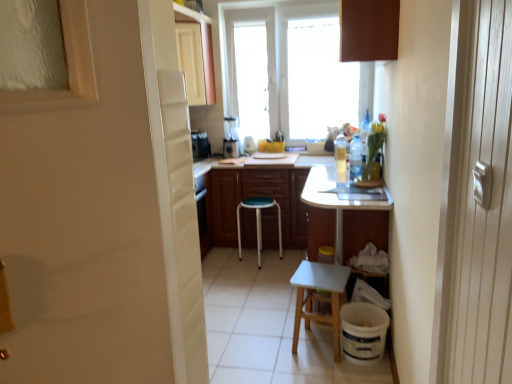
Describe the element at coordinates (259, 222) in the screenshot. This screenshot has height=384, width=512. I see `green plastic stool at center, placed as the first stool when sorted from back to front` at that location.

Describe the element at coordinates (319, 297) in the screenshot. I see `white wood stool at lower center, the 2th stool when ordered from back to front` at that location.

Identify the location of matte white cabinet at upper center, the third cabinetry from the right. (195, 55).

Identify the location of transparent plastic bottle at upper right, which ranks as the 3th bottle in front-to-back order. This screenshot has width=512, height=384. [x=364, y=135].

Identify the location of metallic silver blender at center. (231, 139).

Measure the distance between point (395, 24) and camera.

7.42 feet.

The image size is (512, 384). What do you see at coordinates (369, 30) in the screenshot?
I see `brown matte cabinet at upper center, placed as the 1th cabinetry when sorted from front to back` at bounding box center [369, 30].

Find the location of a particular element. This screenshot has width=512, height=384. green plastic stool at center, the 2th stool in the right-to-left sequence is located at coordinates (259, 222).

Is clear plastic bottle at right, arranged as the 1th bottle when viewed from the front, far away from white glossy screen door at left?

clear plastic bottle at right, arranged as the 1th bottle when viewed from the front, is positioned a significant distance from white glossy screen door at left.

From the image's perspective, is clear plastic bottle at right, the second bottle positioned from the left, beneath white glossy screen door at left?

No.

Is clear plastic bottle at right, the 3th bottle viewed from the back, positioned behind white glossy screen door at left?

Yes, clear plastic bottle at right, the 3th bottle viewed from the back, is further from the camera.

Find the location of `screen door that is in front of the clear plastic bottle at right, arranged as the 1th bottle when viewed from the front`. screen door that is in front of the clear plastic bottle at right, arranged as the 1th bottle when viewed from the front is located at coordinates (174, 190).

From the image's perspective, is white wood stool at lower center, placed as the 1th stool when sorted from front to back, located beneath matte white cabinet at upper center, placed as the first cabinetry when sorted from left to right?

Yes, from the image's perspective, white wood stool at lower center, placed as the 1th stool when sorted from front to back, is beneath matte white cabinet at upper center, placed as the first cabinetry when sorted from left to right.

Is point (297, 302) positioned before point (191, 81)?

Yes.

Could you tell me if white wood stool at lower center, which is counted as the 1th stool, starting from the right, is facing matte white cabinet at upper center, placed as the first cabinetry when sorted from left to right?

No, white wood stool at lower center, which is counted as the 1th stool, starting from the right, is not aimed at matte white cabinet at upper center, placed as the first cabinetry when sorted from left to right.

Is white wood stool at lower center, which is counted as the 1th stool, starting from the right, far away from matte white cabinet at upper center, acting as the first cabinetry starting from the top?

Absolutely, white wood stool at lower center, which is counted as the 1th stool, starting from the right, is distant from matte white cabinet at upper center, acting as the first cabinetry starting from the top.

Considering the sizes of objects matte white cabinet at upper center, positioned as the second cabinetry in front-to-back order, and white wood stool at lower center, which is counted as the 1th stool, starting from the right, in the image provided, who is taller, matte white cabinet at upper center, positioned as the second cabinetry in front-to-back order, or white wood stool at lower center, which is counted as the 1th stool, starting from the right,?

matte white cabinet at upper center, positioned as the second cabinetry in front-to-back order.

Is matte white cabinet at upper center, acting as the 2th cabinetry starting from the back, wider or thinner than white wood stool at lower center, marked as the 2th stool in a left-to-right arrangement?

Considering their sizes, matte white cabinet at upper center, acting as the 2th cabinetry starting from the back, looks broader than white wood stool at lower center, marked as the 2th stool in a left-to-right arrangement.

From the image's perspective, which one is positioned lower, matte white cabinet at upper center, the third cabinetry from the right, or white wood stool at lower center, the 2th stool when ordered from back to front?

white wood stool at lower center, the 2th stool when ordered from back to front.

From a real-world perspective, between matte white cabinet at upper center, arranged as the third cabinetry when ordered from the bottom, and white wood stool at lower center, the 2th stool when ordered from back to front, who is vertically higher?

matte white cabinet at upper center, arranged as the third cabinetry when ordered from the bottom, from a real-world perspective.

Does matte white cabinet at upper center, placed as the first cabinetry when sorted from left to right, have a lesser width compared to green plastic stool at center, placed as the first stool when sorted from back to front?

Yes.

Is matte white cabinet at upper center, positioned as the second cabinetry in front-to-back order, oriented towards green plastic stool at center, placed as the first stool when sorted from left to right?

No, matte white cabinet at upper center, positioned as the second cabinetry in front-to-back order, is not oriented towards green plastic stool at center, placed as the first stool when sorted from left to right.

What are the coordinates of `stool on the left side of brown matte cabinet at center, which appears as the 2th cabinetry when viewed from the right` in the screenshot? It's located at (259, 222).

Considering the sizes of brown matte cabinet at center, marked as the 3th cabinetry in a top-to-bottom arrangement, and green plastic stool at center, the 2th stool from the front, in the image, is brown matte cabinet at center, marked as the 3th cabinetry in a top-to-bottom arrangement, wider or thinner than green plastic stool at center, the 2th stool from the front,?

A: Clearly, brown matte cabinet at center, marked as the 3th cabinetry in a top-to-bottom arrangement, has more width compared to green plastic stool at center, the 2th stool from the front.

Does point (252, 212) appear closer or farther from the camera than point (258, 264)?

Point (252, 212) appears to be farther away from the viewer than point (258, 264).

Could you measure the distance between brown matte cabinet at upper center, marked as the 2th cabinetry in a top-to-bottom arrangement, and white glossy screen door at left?

brown matte cabinet at upper center, marked as the 2th cabinetry in a top-to-bottom arrangement, is 1.46 meters from white glossy screen door at left.

Is the surface of brown matte cabinet at upper center, marked as the 3th cabinetry in a left-to-right arrangement, in direct contact with white glossy screen door at left?

No, brown matte cabinet at upper center, marked as the 3th cabinetry in a left-to-right arrangement, is not making contact with white glossy screen door at left.

Considering the relative positions of brown matte cabinet at upper center, the 1th cabinetry in the right-to-left sequence, and white glossy screen door at left in the image provided, is brown matte cabinet at upper center, the 1th cabinetry in the right-to-left sequence, to the left of white glossy screen door at left from the viewer's perspective?

No.

Can white glossy screen door at left be found inside brown matte cabinet at upper center, placed as the 3th cabinetry when sorted from back to front?

Definitely not — white glossy screen door at left is not inside brown matte cabinet at upper center, placed as the 3th cabinetry when sorted from back to front.

Consider the image. Considering the relative sizes of transparent plastic bottle at upper right, which ranks as the 3th bottle in front-to-back order, and brown matte cabinet at upper center, marked as the 3th cabinetry in a left-to-right arrangement, in the image provided, is transparent plastic bottle at upper right, which ranks as the 3th bottle in front-to-back order, shorter than brown matte cabinet at upper center, marked as the 3th cabinetry in a left-to-right arrangement,?

No.

In the image, is transparent plastic bottle at upper right, which is counted as the 1th bottle, starting from the right, on the left side or the right side of brown matte cabinet at upper center, placed as the 1th cabinetry when sorted from front to back?

In the image, transparent plastic bottle at upper right, which is counted as the 1th bottle, starting from the right, appears on the right side of brown matte cabinet at upper center, placed as the 1th cabinetry when sorted from front to back.

Starting from the brown matte cabinet at upper center, marked as the 2th cabinetry in a top-to-bottom arrangement, which bottle is the 3rd one behind? Please provide its 2D coordinates.

[(364, 135)]

Can you tell me how much transparent plastic bottle at upper right, which ranks as the 3th bottle in front-to-back order, and brown matte cabinet at upper center, positioned as the 2th cabinetry in bottom-to-top order, differ in facing direction?

transparent plastic bottle at upper right, which ranks as the 3th bottle in front-to-back order, and brown matte cabinet at upper center, positioned as the 2th cabinetry in bottom-to-top order, are facing 90 degrees away from each other.

Where is `the 1st bottle above the white glossy screen door at left (from the image's perspective)`? The height and width of the screenshot is (384, 512). the 1st bottle above the white glossy screen door at left (from the image's perspective) is located at coordinates (355, 158).

Identify the location of the 2nd stool below the matte white cabinet at upper center, positioned as the second cabinetry in front-to-back order (from the image's perspective). This screenshot has width=512, height=384. (319, 297).

From the image, which object appears to be nearer to metallic silver blender at center, matte white cabinet at upper center, acting as the first cabinetry starting from the top, or green plastic stool at center, the 2th stool from the front?

Among the two, matte white cabinet at upper center, acting as the first cabinetry starting from the top, is located nearer to metallic silver blender at center.

Which object lies further to the anchor point green plastic stool at center, placed as the first stool when sorted from left to right, white wood stool at lower center, placed as the 1th stool when sorted from front to back, or clear plastic bottle at right, the second bottle positioned from the left?

The object further to green plastic stool at center, placed as the first stool when sorted from left to right, is white wood stool at lower center, placed as the 1th stool when sorted from front to back.

Based on their spatial positions, is brown matte cabinet at center, the first cabinetry in the back-to-front sequence, or metallic silver blender at center further from translucent plastic bottle at upper right, the 2th bottle when ordered from front to back?

metallic silver blender at center lies further to translucent plastic bottle at upper right, the 2th bottle when ordered from front to back, than the other object.

Estimate the real-world distances between objects in this image. Which object is closer to brown matte cabinet at upper center, marked as the 3th cabinetry in a left-to-right arrangement, clear plastic bottle at right, the 3th bottle viewed from the back, or translucent plastic bottle at upper right, the 2th bottle when ordered from front to back?

clear plastic bottle at right, the 3th bottle viewed from the back, is closer to brown matte cabinet at upper center, marked as the 3th cabinetry in a left-to-right arrangement.

Looking at this image, which object lies further to the anchor point clear plastic bottle at right, the 3th bottle viewed from the back, green plastic stool at center, the 2th stool from the front, or white glossy screen door at left?

Based on the image, white glossy screen door at left appears to be further to clear plastic bottle at right, the 3th bottle viewed from the back.

When comparing their distances from clear plastic bottle at right, the second bottle positioned from the left, does brown matte cabinet at center, the first cabinetry in the back-to-front sequence, or brown matte cabinet at upper center, the 1th cabinetry in the right-to-left sequence, seem further?

brown matte cabinet at center, the first cabinetry in the back-to-front sequence, is further to clear plastic bottle at right, the second bottle positioned from the left.

Based on their spatial positions, is brown matte cabinet at upper center, marked as the 2th cabinetry in a top-to-bottom arrangement, or brown matte cabinet at center, which appears as the 1th cabinetry when ordered from the bottom, further from white glossy screen door at left?

brown matte cabinet at center, which appears as the 1th cabinetry when ordered from the bottom, lies further to white glossy screen door at left than the other object.

When comparing their distances from translucent plastic bottle at upper right, the 2th bottle when ordered from front to back, does clear plastic bottle at right, the 3th bottle viewed from the back, or white glossy screen door at left seem closer?

clear plastic bottle at right, the 3th bottle viewed from the back, is positioned closer to the anchor translucent plastic bottle at upper right, the 2th bottle when ordered from front to back.

Where is `bottle between translucent plastic bottle at upper right, the 2th bottle when ordered from front to back, and white wood stool at lower center, the 2th stool when ordered from back to front, in the up-down direction`? The width and height of the screenshot is (512, 384). bottle between translucent plastic bottle at upper right, the 2th bottle when ordered from front to back, and white wood stool at lower center, the 2th stool when ordered from back to front, in the up-down direction is located at coordinates (355, 158).

Find the location of a particular element. The height and width of the screenshot is (384, 512). cabinetry between white glossy screen door at left and matte white cabinet at upper center, positioned as the second cabinetry in front-to-back order, in the front-back direction is located at coordinates (369, 30).

The height and width of the screenshot is (384, 512). What are the coordinates of `appliance situated between matte white cabinet at upper center, the third cabinetry from the right, and translucent plastic bottle at upper right, which is the third bottle from right to left, from left to right` in the screenshot? It's located at (231, 139).

You are a GUI agent. You are given a task and a screenshot of the screen. Output one action in this format:
    pyautogui.click(x=<x>, y=<y>)
    Task: Click on the cabinetry between metallic silver blender at center and translucent plastic bottle at upper right, the second bottle in the back-to-front sequence
    
    Given the screenshot: What is the action you would take?
    pyautogui.click(x=258, y=195)